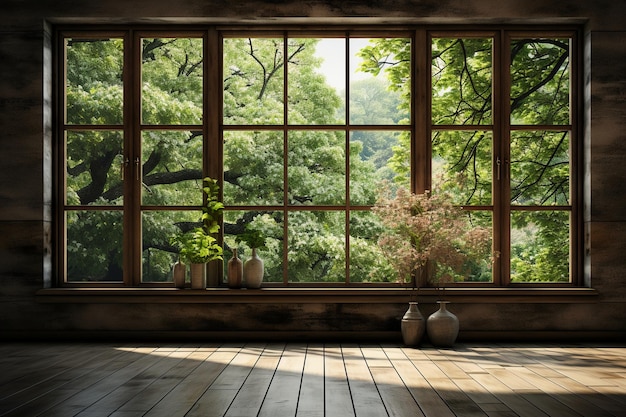
The width and height of the screenshot is (626, 417). Identify the location of vases. (173, 280), (198, 279), (233, 275), (255, 270), (414, 327), (442, 327).